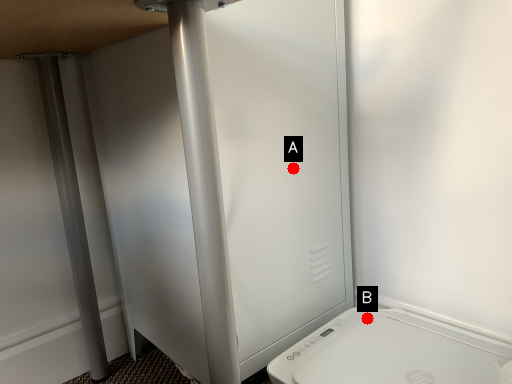
Question: Two points are circled on the image, labeled by A and B beside each circle. Which point is closer to the camera taking this photo?

Choices:
 (A) A is closer
 (B) B is closer

Answer: (A)